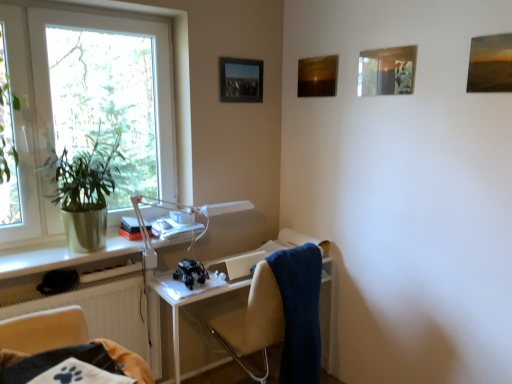
I want to click on beige fabric chair at lower left, the 1th chair when ordered from front to back, so click(44, 330).

Identify the location of beige fabric chair at center, arranged as the second chair when viewed from the left. (280, 315).

Measure the distance between black plastic toy at center, which is counted as the 1th equipment, starting from the bottom, and camera.

The distance of black plastic toy at center, which is counted as the 1th equipment, starting from the bottom, from camera is 6.82 feet.

The height and width of the screenshot is (384, 512). What do you see at coordinates (241, 80) in the screenshot? I see `metallic silver picture frame at upper center, the 4th picture frame viewed from the right` at bounding box center [241, 80].

Locate an element on the screen. This screenshot has width=512, height=384. metallic silver picture frame at upper center, placed as the fourth picture frame when sorted from front to back is located at coordinates (241, 80).

Where is `white plastic window at left`? This screenshot has height=384, width=512. white plastic window at left is located at coordinates (54, 105).

Find the location of a particular element. The image size is (512, 384). beige fabric chair at lower left, the second chair viewed from the right is located at coordinates pos(44,330).

Which object is wider, white plastic window at left or matte wooden picture frame at upper center, the 2th picture frame from the left?

Wider between the two is white plastic window at left.

Is there a large distance between white plastic window at left and matte wooden picture frame at upper center, acting as the 2th picture frame starting from the back?

Yes, white plastic window at left and matte wooden picture frame at upper center, acting as the 2th picture frame starting from the back, are quite far apart.

Would you say white plastic window at left is inside or outside matte wooden picture frame at upper center, the 2th picture frame from the left?

white plastic window at left is not inside matte wooden picture frame at upper center, the 2th picture frame from the left, it's outside.

Is white plastic window at left smaller than matte wooden picture frame at upper center, acting as the 2th picture frame starting from the back?

Incorrect, white plastic window at left is not smaller in size than matte wooden picture frame at upper center, acting as the 2th picture frame starting from the back.

Is beige fabric chair at center, the second chair when ordered from front to back, shorter than metallic reflective picture frame at upper right, the 2th picture frame in the front-to-back sequence?

In fact, beige fabric chair at center, the second chair when ordered from front to back, may be taller than metallic reflective picture frame at upper right, the 2th picture frame in the front-to-back sequence.

Is there a large distance between beige fabric chair at center, the second chair when ordered from front to back, and metallic reflective picture frame at upper right, the 2th picture frame in the front-to-back sequence?

Yes, beige fabric chair at center, the second chair when ordered from front to back, and metallic reflective picture frame at upper right, the 2th picture frame in the front-to-back sequence, are located far from each other.

Would you say beige fabric chair at center, arranged as the second chair when viewed from the left, is inside or outside metallic reflective picture frame at upper right, the 2th picture frame in the front-to-back sequence?

beige fabric chair at center, arranged as the second chair when viewed from the left, exists outside the volume of metallic reflective picture frame at upper right, the 2th picture frame in the front-to-back sequence.

Considering the points (300, 367) and (397, 92), which point is in front, point (300, 367) or point (397, 92)?

Positioned in front is point (397, 92).

Find the location of a particular element. Image resolution: width=512 pixels, height=384 pixels. the 2nd equipment behind when counting from the beige fabric chair at center, arranged as the second chair when viewed from the left is located at coordinates (214, 212).

Are beige fabric chair at center, arranged as the second chair when viewed from the left, and white plastic desk lamp at upper left, which is the 1th equipment in top-to-bottom order, beside each other?

No, beige fabric chair at center, arranged as the second chair when viewed from the left, is not making contact with white plastic desk lamp at upper left, which is the 1th equipment in top-to-bottom order.

Is beige fabric chair at center, arranged as the second chair when viewed from the left, thinner than white plastic desk lamp at upper left, which is the 1th equipment in top-to-bottom order?

Incorrect, the width of beige fabric chair at center, arranged as the second chair when viewed from the left, is not less than that of white plastic desk lamp at upper left, which is the 1th equipment in top-to-bottom order.

Does beige fabric chair at center, arranged as the second chair when viewed from the left, turn towards white plastic desk lamp at upper left, which is the 1th equipment in top-to-bottom order?

No, beige fabric chair at center, arranged as the second chair when viewed from the left, is not oriented towards white plastic desk lamp at upper left, which is the 1th equipment in top-to-bottom order.

Can you tell me how much beige fabric chair at center, arranged as the second chair when viewed from the left, and beige fabric chair at lower left, the 1th chair when ordered from front to back, differ in facing direction?

179 degrees.

Which of these two, beige fabric chair at center, arranged as the second chair when viewed from the left, or beige fabric chair at lower left, the 2th chair from the back, stands taller?

beige fabric chair at center, arranged as the second chair when viewed from the left, is taller.

Is beige fabric chair at center, which is the first chair from back to front, to the right of beige fabric chair at lower left, the first chair viewed from the left, from the viewer's perspective?

Correct, you'll find beige fabric chair at center, which is the first chair from back to front, to the right of beige fabric chair at lower left, the first chair viewed from the left.

In the scene shown: From the image's perspective, is beige fabric chair at center, which is the first chair from back to front, below beige fabric chair at lower left, the second chair viewed from the right?

Yes, from the image's perspective, beige fabric chair at center, which is the first chair from back to front, is beneath beige fabric chair at lower left, the second chair viewed from the right.

Is white plastic window at left not close to metallic silver picture frame at upper center, placed as the fourth picture frame when sorted from front to back?

No.

Looking at this image, is white plastic window at left oriented away from metallic silver picture frame at upper center, the 4th picture frame viewed from the right?

white plastic window at left does not have its back to metallic silver picture frame at upper center, the 4th picture frame viewed from the right.

From a real-world perspective, which is physically below, white plastic window at left or metallic silver picture frame at upper center, the first picture frame viewed from the left?

In real-world perspective, white plastic window at left is lower.

From the image's perspective, which one is positioned higher, white plastic window at left or metallic silver picture frame at upper center, the 4th picture frame viewed from the right?

metallic silver picture frame at upper center, the 4th picture frame viewed from the right, is shown above in the image.

From the image's perspective, is metallic reflective picture frame at upper right, which ranks as the third picture frame in left-to-right order, on top of white plastic desk lamp at upper left, which is the 1th equipment in top-to-bottom order?

Yes, from the image's perspective, metallic reflective picture frame at upper right, which ranks as the third picture frame in left-to-right order, is above white plastic desk lamp at upper left, which is the 1th equipment in top-to-bottom order.

What's the angular difference between metallic reflective picture frame at upper right, positioned as the 3th picture frame in back-to-front order, and white plastic desk lamp at upper left, which appears as the 2th equipment when ordered from the bottom,'s facing directions?

metallic reflective picture frame at upper right, positioned as the 3th picture frame in back-to-front order, and white plastic desk lamp at upper left, which appears as the 2th equipment when ordered from the bottom, are facing 89.5 degrees away from each other.

Is metallic reflective picture frame at upper right, the 2th picture frame in the front-to-back sequence, thinner than white plastic desk lamp at upper left, which is the 1th equipment in top-to-bottom order?

Yes.

Is metallic reflective picture frame at upper right, which appears as the 2th picture frame when viewed from the right, with white plastic desk lamp at upper left, which is the 1th equipment in top-to-bottom order?

There is a gap between metallic reflective picture frame at upper right, which appears as the 2th picture frame when viewed from the right, and white plastic desk lamp at upper left, which is the 1th equipment in top-to-bottom order.

From the image's perspective, is matte wooden picture frame at upper right, which ranks as the first picture frame in front-to-back order, located above matte white window sill at lower left?

Yes, from the image's perspective, matte wooden picture frame at upper right, which ranks as the first picture frame in front-to-back order, is over matte white window sill at lower left.

Would you say matte wooden picture frame at upper right, marked as the fourth picture frame in a left-to-right arrangement, is outside matte white window sill at lower left?

Yes, matte wooden picture frame at upper right, marked as the fourth picture frame in a left-to-right arrangement, is not within matte white window sill at lower left.

Can you confirm if matte wooden picture frame at upper right, the 1th picture frame in the right-to-left sequence, is bigger than matte white window sill at lower left?

No.

Could you measure the distance between matte wooden picture frame at upper right, which is the 4th picture frame from back to front, and matte white window sill at lower left?

matte wooden picture frame at upper right, which is the 4th picture frame from back to front, and matte white window sill at lower left are 1.79 meters apart from each other.

Locate an element on the screen. The height and width of the screenshot is (384, 512). the 2nd picture frame behind the white plastic window at left, starting your count from the anchor is located at coordinates (317, 76).

This screenshot has width=512, height=384. Find the location of `the 4th picture frame positioned above the beige fabric chair at center, which is the first chair from back to front (from a real-world perspective)`. the 4th picture frame positioned above the beige fabric chair at center, which is the first chair from back to front (from a real-world perspective) is located at coordinates (387, 71).

From the image, which object appears to be farther from metallic reflective picture frame at upper right, the 2th picture frame in the front-to-back sequence, beige fabric chair at lower left, the 1th chair when ordered from front to back, or white plastic desk lamp at upper left, which appears as the 2th equipment when ordered from the bottom?

The object further to metallic reflective picture frame at upper right, the 2th picture frame in the front-to-back sequence, is beige fabric chair at lower left, the 1th chair when ordered from front to back.

From the image, which object appears to be farther from metallic silver picture frame at upper center, the first picture frame viewed from the left, matte wooden picture frame at upper center, the third picture frame positioned from the right, or green leafy plant at left?

green leafy plant at left is positioned further to the anchor metallic silver picture frame at upper center, the first picture frame viewed from the left.

Looking at the image, which one is located closer to white plastic window at left, matte wooden picture frame at upper right, which ranks as the first picture frame in front-to-back order, or matte white window sill at lower left?

matte white window sill at lower left lies closer to white plastic window at left than the other object.

Estimate the real-world distances between objects in this image. Which object is further from white plastic desk lamp at upper left, which appears as the 2th equipment when ordered from the bottom, black plastic toy at center, which is counted as the 1th equipment, starting from the bottom, or blue soft towel at right?

blue soft towel at right.

From the picture: When comparing their distances from beige fabric chair at center, arranged as the second chair when viewed from the left, does blue soft towel at right or metallic silver picture frame at upper center, the 4th picture frame viewed from the right, seem closer?

blue soft towel at right.

Which object lies further to the anchor point green leafy plant at left, matte wooden picture frame at upper center, the third picture frame positioned from the front, or white plastic window at left?

Among the two, matte wooden picture frame at upper center, the third picture frame positioned from the front, is located further to green leafy plant at left.

Looking at the image, which one is located further to metallic silver picture frame at upper center, the 4th picture frame viewed from the right, green leafy plant at left or matte white window sill at lower left?

The object further to metallic silver picture frame at upper center, the 4th picture frame viewed from the right, is matte white window sill at lower left.

Consider the image. Based on their spatial positions, is black plastic toy at center, which is counted as the 1th equipment, starting from the bottom, or metallic silver picture frame at upper center, marked as the 1th picture frame in a back-to-front arrangement, further from green leafy plant at left?

Among the two, metallic silver picture frame at upper center, marked as the 1th picture frame in a back-to-front arrangement, is located further to green leafy plant at left.

This screenshot has width=512, height=384. In order to click on equipment between green leafy plant at left and white plastic desk lamp at upper left, which appears as the 2th equipment when ordered from the bottom, from left to right in this screenshot , I will do `click(190, 272)`.

Locate an element on the screen. window sill located between beige fabric chair at lower left, the first chair viewed from the left, and matte wooden picture frame at upper center, the 2th picture frame from the left, in the depth direction is located at coordinates (61, 255).

You are a GUI agent. You are given a task and a screenshot of the screen. Output one action in this format:
    pyautogui.click(x=<x>, y=<y>)
    Task: Click on the window sill between white plastic window at left and beige fabric chair at center, the 1th chair in the right-to-left sequence, vertically
    The image size is (512, 384).
    Given the screenshot: What is the action you would take?
    pyautogui.click(x=61, y=255)

Where is `houseplant that lies between white plastic window at left and beige fabric chair at center, which is the first chair from back to front, from top to bottom`? houseplant that lies between white plastic window at left and beige fabric chair at center, which is the first chair from back to front, from top to bottom is located at coordinates (86, 189).